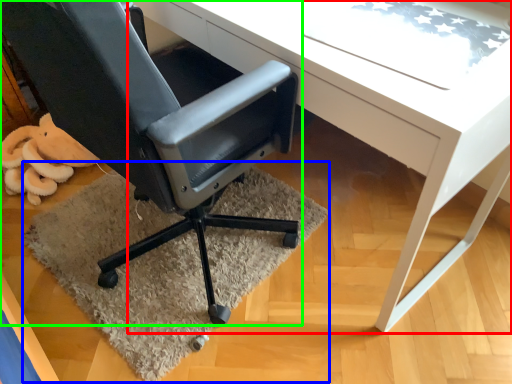
Question: Which object is positioned farthest from desk (highlighted by a red box)? Select from mat (highlighted by a blue box) and chair (highlighted by a green box).

Choices:
 (A) mat
 (B) chair

Answer: (A)